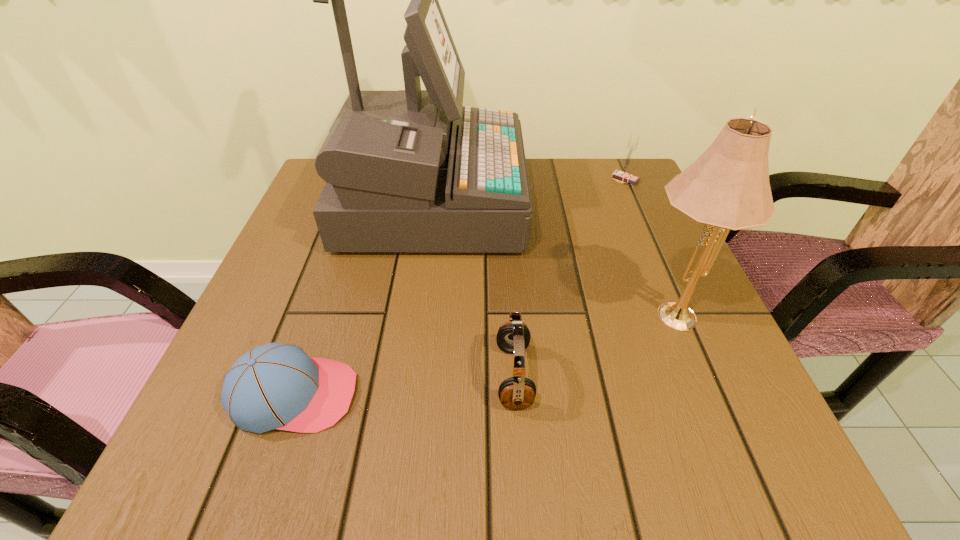
Where is `object at the near left corner`? The height and width of the screenshot is (540, 960). object at the near left corner is located at coordinates (278, 386).

Image resolution: width=960 pixels, height=540 pixels. I want to click on object positioned at the far right corner, so click(x=623, y=174).

You are a GUI agent. You are given a task and a screenshot of the screen. Output one action in this format:
    pyautogui.click(x=<x>, y=<y>)
    Task: Click on the vacant space at the near edge of the desktop
    This screenshot has width=960, height=540.
    Given the screenshot: What is the action you would take?
    pyautogui.click(x=523, y=453)

You are a GUI agent. You are given a task and a screenshot of the screen. Output one action in this format:
    pyautogui.click(x=<x>, y=<y>)
    Task: Click on the vacant space at the left edge of the desktop
    
    Given the screenshot: What is the action you would take?
    pyautogui.click(x=313, y=288)

The image size is (960, 540). Identify the location of vacant space at the right edge. (625, 325).

Where is `vacant space at the far right corner of the desktop`? Image resolution: width=960 pixels, height=540 pixels. vacant space at the far right corner of the desktop is located at coordinates (617, 185).

You are a GUI agent. You are given a task and a screenshot of the screen. Output one action in this format:
    pyautogui.click(x=<x>, y=<y>)
    Task: Click on the vacant space at the near right corner
    
    Given the screenshot: What is the action you would take?
    pyautogui.click(x=701, y=452)

I want to click on vacant point located between the lampshade and the cash register, so click(549, 256).

This screenshot has width=960, height=540. I want to click on empty space that is in between the matchbox and the headset, so click(569, 278).

Identify the location of vacant region between the baseball cap and the lampshade. (482, 353).